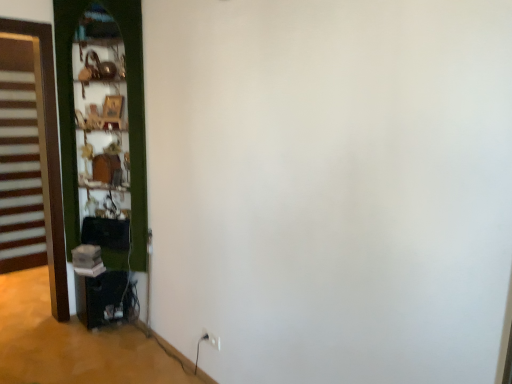
This screenshot has width=512, height=384. What do you see at coordinates (211, 339) in the screenshot?
I see `white plastic electric outlet at lower center` at bounding box center [211, 339].

In order to face white plastic electric outlet at lower center, should I rotate leftwards or rightwards?

You should rotate left by 5.869 degrees.

Where is `green wooden door at left, arranged as the 2th door when viewed from the left`? Image resolution: width=512 pixels, height=384 pixels. green wooden door at left, arranged as the 2th door when viewed from the left is located at coordinates (134, 119).

Which is behind, point (34, 257) or point (202, 334)?

Point (34, 257)

From a real-world perspective, does brown wooden door at left, positioned as the second door in right-to-left order, stand above white plastic electric outlet at lower center?

Yes.

Can you confirm if brown wooden door at left, positioned as the second door in right-to-left order, is wider than white plastic electric outlet at lower center?

Indeed, brown wooden door at left, positioned as the second door in right-to-left order, has a greater width compared to white plastic electric outlet at lower center.

From the image's perspective, which is below, brown wooden door at left, the 1th door viewed from the left, or white plastic electric outlet at lower center?

white plastic electric outlet at lower center appears lower in the image.

Who is smaller, brown wooden door at left, the 1th door viewed from the left, or green wooden door at left, arranged as the 2th door when viewed from the left?

brown wooden door at left, the 1th door viewed from the left, is smaller.

From a real-world perspective, is brown wooden door at left, the 1th door viewed from the left, under green wooden door at left, arranged as the 2th door when viewed from the left?

Indeed, from a real-world perspective, brown wooden door at left, the 1th door viewed from the left, is positioned beneath green wooden door at left, arranged as the 2th door when viewed from the left.

Considering the relative positions of brown wooden door at left, positioned as the second door in right-to-left order, and green wooden door at left, acting as the 1th door starting from the right, in the image provided, is brown wooden door at left, positioned as the second door in right-to-left order, to the right of green wooden door at left, acting as the 1th door starting from the right, from the viewer's perspective?

In fact, brown wooden door at left, positioned as the second door in right-to-left order, is to the left of green wooden door at left, acting as the 1th door starting from the right.

Could you tell me if brown wooden door at left, the 1th door viewed from the left, is facing green wooden door at left, acting as the 1th door starting from the right?

No, brown wooden door at left, the 1th door viewed from the left, is not turned towards green wooden door at left, acting as the 1th door starting from the right.

Where is `door located in front of the green wooden door at left, acting as the 1th door starting from the right`? door located in front of the green wooden door at left, acting as the 1th door starting from the right is located at coordinates (31, 158).

Is green wooden door at left, arranged as the 2th door when viewed from the left, to the left of brown wooden door at left, positioned as the second door in right-to-left order, from the viewer's perspective?

No.

Does point (67, 166) come in front of point (35, 173)?

Yes, point (67, 166) is in front of point (35, 173).

Based on the photo, from the image's perspective, which is above, green wooden door at left, arranged as the 2th door when viewed from the left, or brown wooden door at left, the 1th door viewed from the left?

green wooden door at left, arranged as the 2th door when viewed from the left, from the image's perspective.

Does white plastic electric outlet at lower center have a greater height compared to brown wooden door at left, the 1th door viewed from the left?

No, white plastic electric outlet at lower center is not taller than brown wooden door at left, the 1th door viewed from the left.

From a real-world perspective, is white plastic electric outlet at lower center below brown wooden door at left, positioned as the second door in right-to-left order?

Yes.

Can we say white plastic electric outlet at lower center lies outside brown wooden door at left, the 1th door viewed from the left?

white plastic electric outlet at lower center is positioned outside brown wooden door at left, the 1th door viewed from the left.

Find the location of a particular element. electric outlet below the brown wooden door at left, positioned as the second door in right-to-left order (from the image's perspective) is located at coordinates (211, 339).

From a real-world perspective, is white plastic electric outlet at lower center over green wooden door at left, arranged as the 2th door when viewed from the left?

No, from a real-world perspective, white plastic electric outlet at lower center is not above green wooden door at left, arranged as the 2th door when viewed from the left.

Is white plastic electric outlet at lower center positioned far away from green wooden door at left, acting as the 1th door starting from the right?

Yes, white plastic electric outlet at lower center is far from green wooden door at left, acting as the 1th door starting from the right.

Does point (202, 336) come closer to viewer compared to point (140, 194)?

That is True.

In the image, is white plastic electric outlet at lower center on the left side or the right side of green wooden door at left, acting as the 1th door starting from the right?

white plastic electric outlet at lower center is to the right of green wooden door at left, acting as the 1th door starting from the right.

Can you tell me how much green wooden door at left, arranged as the 2th door when viewed from the left, and white plastic electric outlet at lower center differ in facing direction?

31.4 degrees separate the facing orientations of green wooden door at left, arranged as the 2th door when viewed from the left, and white plastic electric outlet at lower center.

Is there a large distance between green wooden door at left, acting as the 1th door starting from the right, and white plastic electric outlet at lower center?

That's right, there is a large distance between green wooden door at left, acting as the 1th door starting from the right, and white plastic electric outlet at lower center.

Based on the photo, is white plastic electric outlet at lower center at the back of green wooden door at left, arranged as the 2th door when viewed from the left?

green wooden door at left, arranged as the 2th door when viewed from the left, is not turned away from white plastic electric outlet at lower center.

Considering the relative sizes of green wooden door at left, acting as the 1th door starting from the right, and white plastic electric outlet at lower center in the image provided, is green wooden door at left, acting as the 1th door starting from the right, smaller than white plastic electric outlet at lower center?

No, green wooden door at left, acting as the 1th door starting from the right, is not smaller than white plastic electric outlet at lower center.

In the image, there is a brown wooden door at left, the 1th door viewed from the left. Where is `electric outlet below it (from the image's perspective)`? electric outlet below it (from the image's perspective) is located at coordinates (211, 339).

Identify the location of door on the right of brown wooden door at left, positioned as the second door in right-to-left order. This screenshot has width=512, height=384. (134, 119).

Estimate the real-world distances between objects in this image. Which object is further from white plastic electric outlet at lower center, brown wooden door at left, the 1th door viewed from the left, or green wooden door at left, acting as the 1th door starting from the right?

brown wooden door at left, the 1th door viewed from the left, lies further to white plastic electric outlet at lower center than the other object.

Considering their positions, is green wooden door at left, arranged as the 2th door when viewed from the left, positioned further to white plastic electric outlet at lower center than brown wooden door at left, the 1th door viewed from the left?

brown wooden door at left, the 1th door viewed from the left.

Considering their positions, is white plastic electric outlet at lower center positioned closer to brown wooden door at left, positioned as the second door in right-to-left order, than green wooden door at left, arranged as the 2th door when viewed from the left?

green wooden door at left, arranged as the 2th door when viewed from the left, is positioned closer to the anchor brown wooden door at left, positioned as the second door in right-to-left order.

Looking at the image, which one is located closer to green wooden door at left, acting as the 1th door starting from the right, brown wooden door at left, the 1th door viewed from the left, or white plastic electric outlet at lower center?

The object closer to green wooden door at left, acting as the 1th door starting from the right, is white plastic electric outlet at lower center.

Looking at the image, which one is located further to green wooden door at left, arranged as the 2th door when viewed from the left, white plastic electric outlet at lower center or brown wooden door at left, positioned as the second door in right-to-left order?

Based on the image, brown wooden door at left, positioned as the second door in right-to-left order, appears to be further to green wooden door at left, arranged as the 2th door when viewed from the left.

Considering their positions, is green wooden door at left, acting as the 1th door starting from the right, positioned closer to brown wooden door at left, positioned as the second door in right-to-left order, than white plastic electric outlet at lower center?

green wooden door at left, acting as the 1th door starting from the right, is closer to brown wooden door at left, positioned as the second door in right-to-left order.

Locate an element on the screen. The image size is (512, 384). door located between brown wooden door at left, the 1th door viewed from the left, and white plastic electric outlet at lower center in the left-right direction is located at coordinates (134, 119).